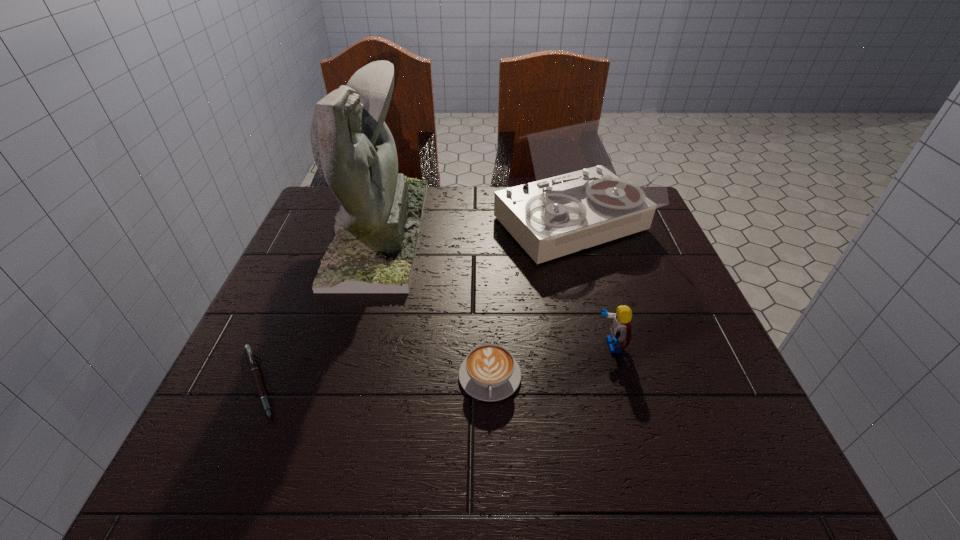
Locate an element on the screen. vacant region located 0.110m on the side of the fourth tallest object with the handle is located at coordinates (492, 470).

At what (x,y) coordinates should I click in order to perform the action: click on free space located 0.210m at the nib of the shortest object. Please return your answer as a coordinate pair (x, y). Image resolution: width=960 pixels, height=540 pixels. Looking at the image, I should click on (404, 382).

Locate an element on the screen. sculpture located in the far edge section of the desktop is located at coordinates (377, 227).

You are a GUI agent. You are given a task and a screenshot of the screen. Output one action in this format:
    pyautogui.click(x=<x>, y=<y>)
    Task: Click on the record player that is at the far edge
    
    Given the screenshot: What is the action you would take?
    pyautogui.click(x=597, y=181)

The width and height of the screenshot is (960, 540). I want to click on sculpture at the left edge, so click(377, 227).

Image resolution: width=960 pixels, height=540 pixels. In order to click on pen present at the left edge in this screenshot , I will do pyautogui.click(x=250, y=356).

The width and height of the screenshot is (960, 540). What are the coordinates of `object that is at the right edge` in the screenshot? It's located at (597, 181).

You are a GUI agent. You are given a task and a screenshot of the screen. Output one action in this format:
    pyautogui.click(x=<x>, y=<y>)
    Task: Click on the object at the far left corner
    
    Given the screenshot: What is the action you would take?
    pyautogui.click(x=377, y=227)

Where is `object located in the far right corner section of the desktop`? The height and width of the screenshot is (540, 960). object located in the far right corner section of the desktop is located at coordinates (597, 181).

In the image, there is a desktop. Identify the location of vacant area at the far edge. Image resolution: width=960 pixels, height=540 pixels. (493, 200).